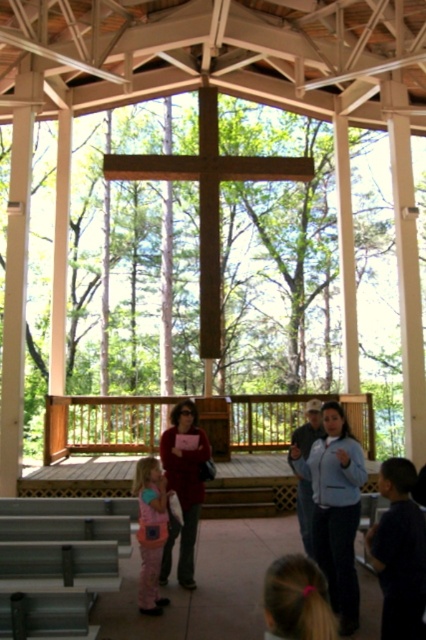
Question: Can you confirm if light blue jacket at lower right is positioned to the left of light blue shirt at center?

Choices:
 (A) yes
 (B) no

Answer: (B)

Question: Which of the following is the farthest from the observer?

Choices:
 (A) pink fleece jacket at lower left
 (B) light blue jacket at lower right
 (C) matte red sweater at center
 (D) wooden deck at center

Answer: (D)

Question: Does pink fleece jacket at lower left have a lesser width compared to light blue shirt at center?

Choices:
 (A) no
 (B) yes

Answer: (B)

Question: Does wooden deck at center have a greater width compared to pink fleece jacket at lower left?

Choices:
 (A) no
 (B) yes

Answer: (A)

Question: Estimate the real-world distances between objects in this image. Which object is closer to the pink fleece jacket at lower left?

Choices:
 (A) dark blue shirt at lower right
 (B) light blue jacket at lower right
 (C) light blue shirt at center
 (D) wooden deck at center

Answer: (C)

Question: Among these points, which one is farthest from the camera?

Choices:
 (A) tap(154, 564)
 (B) tap(313, 429)

Answer: (B)